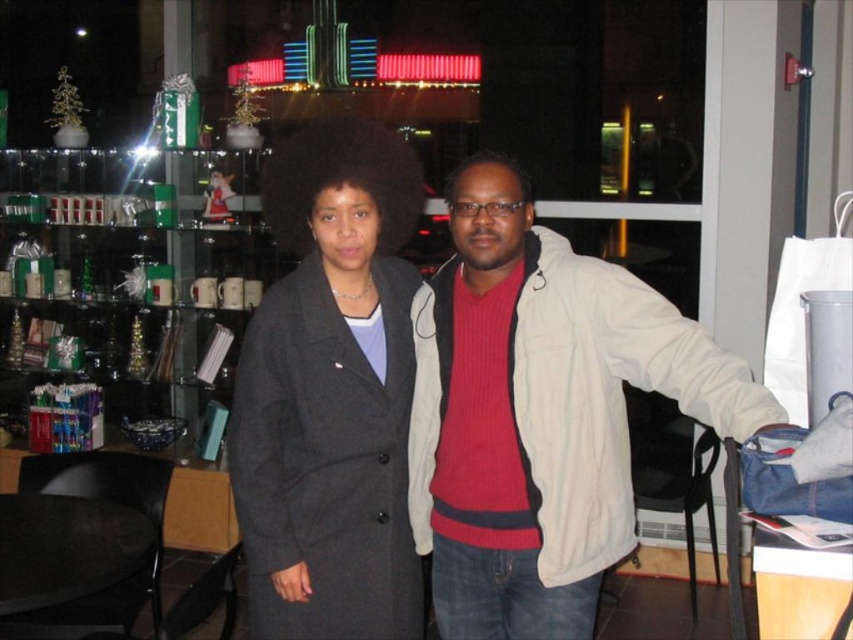
Between matte beige jacket at center and matte gray coat at center, which one appears on the right side from the viewer's perspective?

From the viewer's perspective, matte beige jacket at center appears more on the right side.

Is the position of matte beige jacket at center more distant than that of matte gray coat at center?

No, matte beige jacket at center is in front of matte gray coat at center.

This screenshot has height=640, width=853. Identify the location of matte beige jacket at center. (540, 412).

Image resolution: width=853 pixels, height=640 pixels. In order to click on matte beige jacket at center in this screenshot , I will do `click(540, 412)`.